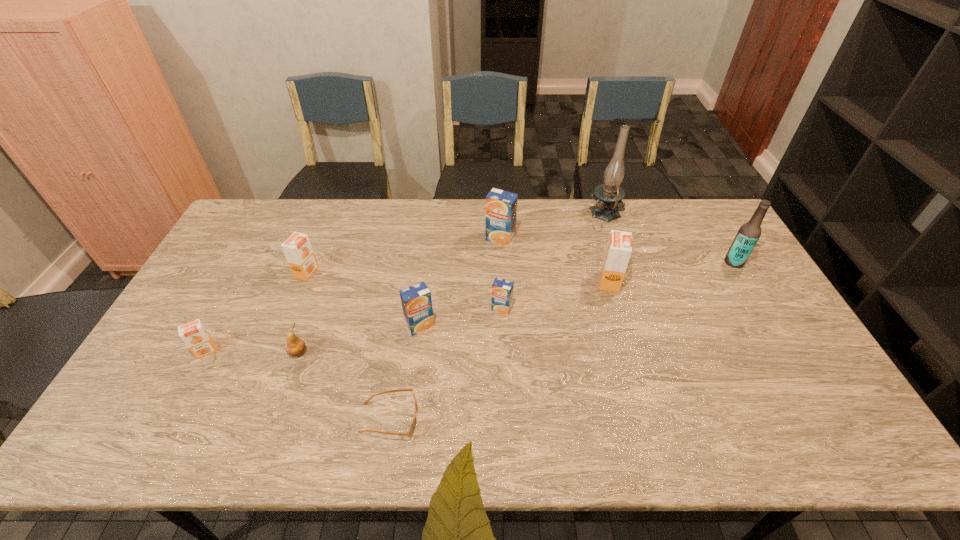
Where is `vacant space at the far left corner of the desktop`? vacant space at the far left corner of the desktop is located at coordinates click(255, 202).

This screenshot has width=960, height=540. In order to click on vacant space at the far right corner of the desktop in this screenshot , I will do `click(702, 221)`.

Image resolution: width=960 pixels, height=540 pixels. What are the coordinates of `vacant area that lies between the ninth shortest object and the smallest orange orange juice` in the screenshot? It's located at (470, 307).

Locate an element on the screen. vacant space that's between the rightmost orange juice and the second nearest blue orange_juice is located at coordinates (556, 295).

This screenshot has height=540, width=960. Find the location of `free point between the rightmost object and the biggest orange orange juice`. free point between the rightmost object and the biggest orange orange juice is located at coordinates [672, 272].

Where is `free point between the tallest object and the nearest blue orange_juice`? free point between the tallest object and the nearest blue orange_juice is located at coordinates (513, 271).

Find the location of `free point between the pear and the biggest blue orange_juice`. free point between the pear and the biggest blue orange_juice is located at coordinates (399, 295).

Identify the location of free space between the sunglasses and the farthest orange juice. Image resolution: width=960 pixels, height=540 pixels. (444, 329).

What are the coordinates of `free spot between the rightmost orange orange juice and the ninth object from right to left` in the screenshot? It's located at (458, 277).

Where is `vacant area that lies between the rightmost orange juice and the fifth nearest object`? The height and width of the screenshot is (540, 960). vacant area that lies between the rightmost orange juice and the fifth nearest object is located at coordinates (556, 295).